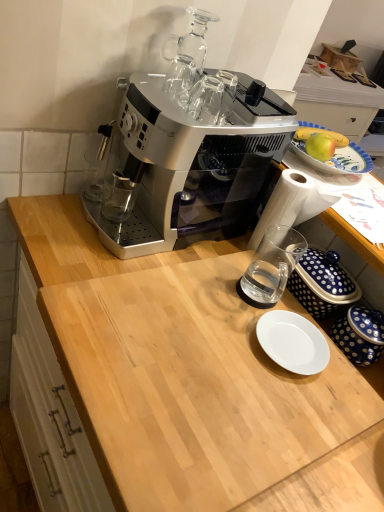
What do you see at coordinates (360, 335) in the screenshot? I see `blue dotted ceramic jar at lower right` at bounding box center [360, 335].

Find the location of `satin silver coffee maker at upper center`. satin silver coffee maker at upper center is located at coordinates (188, 163).

Is satin silver coffee maker at upper center beside white glossy plate at center?

No, satin silver coffee maker at upper center is not in contact with white glossy plate at center.

From the picture: How different are the orientations of satin silver coffee maker at upper center and white glossy plate at center in degrees?

0.000922 degrees.

From a real-world perspective, is satin silver coffee maker at upper center positioned above or below white glossy plate at center?

Clearly, from a real-world perspective, satin silver coffee maker at upper center is above white glossy plate at center.

Visually, is white glossy plate at center positioned to the left or to the right of clear glass cup at center?

Clearly, white glossy plate at center is on the right of clear glass cup at center in the image.

Is white glossy plate at center oriented away from clear glass cup at center?

white glossy plate at center is not turned away from clear glass cup at center.

From the image's perspective, is white glossy plate at center above clear glass cup at center?

Incorrect, from the image's perspective, white glossy plate at center is lower than clear glass cup at center.

Which object is more forward, clear glass cup at center or white glossy plate at center?

white glossy plate at center is closer to the camera.

Could you tell me if clear glass cup at center is turned towards white glossy plate at center?

No, clear glass cup at center is not turned towards white glossy plate at center.

Looking at this image, based on their positions, is clear glass cup at center located to the left or right of white glossy plate at center?

Clearly, clear glass cup at center is on the left of white glossy plate at center in the image.

From a real-world perspective, is light wood cutting board at center on top of white glossy plate at center?

No, from a real-world perspective, light wood cutting board at center is not on top of white glossy plate at center.

Considering the positions of point (133, 506) and point (261, 345), is point (133, 506) closer or farther from the camera than point (261, 345)?

Point (133, 506) is positioned closer to the camera compared to point (261, 345).

Which is correct: light wood cutting board at center is inside white glossy plate at center, or outside of it?

light wood cutting board at center is located beyond the bounds of white glossy plate at center.

From the image's perspective, would you say light wood cutting board at center is shown under white glossy plate at center?

Indeed, from the image's perspective, light wood cutting board at center is shown beneath white glossy plate at center.

Find the location of a particular element. This screenshot has height=512, width=384. counter top lying below the blue dotted ceramic jar at lower right (from the image's perspective) is located at coordinates (193, 388).

Does blue dotted ceramic jar at lower right have a lesser height compared to light wood cutting board at center?

Incorrect, the height of blue dotted ceramic jar at lower right does not fall short of that of light wood cutting board at center.

Is blue dotted ceramic jar at lower right bigger or smaller than light wood cutting board at center?

In the image, blue dotted ceramic jar at lower right appears to be smaller than light wood cutting board at center.

Is there a large distance between blue dotted ceramic jar at lower right and light wood cutting board at center?

→ blue dotted ceramic jar at lower right is actually quite close to light wood cutting board at center.

Based on their positions, is satin silver coffee maker at upper center located to the left or right of green matte apple at upper right?

satin silver coffee maker at upper center is positioned on green matte apple at upper right's left side.

Considering their positions, is satin silver coffee maker at upper center located in front of or behind green matte apple at upper right?

satin silver coffee maker at upper center is positioned closer to the viewer than green matte apple at upper right.

Is satin silver coffee maker at upper center facing away from green matte apple at upper right?

Yes, satin silver coffee maker at upper center is facing away from green matte apple at upper right.

Are satin silver coffee maker at upper center and green matte apple at upper right making contact?

satin silver coffee maker at upper center and green matte apple at upper right are not in contact.

In terms of width, does clear glass cup at center look wider or thinner when compared to satin silver coffee maker at upper center?

Considering their sizes, clear glass cup at center looks slimmer than satin silver coffee maker at upper center.

Locate an element on the screen. This screenshot has height=512, width=384. coffee cup below the satin silver coffee maker at upper center (from a real-world perspective) is located at coordinates (271, 266).

Between point (298, 253) and point (135, 152), which one is positioned in front?

The point (135, 152) is closer to the camera.

Is clear glass cup at center inside the boundaries of satin silver coffee maker at upper center, or outside?

clear glass cup at center exists outside the volume of satin silver coffee maker at upper center.

You are a GUI agent. You are given a task and a screenshot of the screen. Output one action in this format:
    pyautogui.click(x=<x>, y=<y>)
    Task: Click on the plate that is under the satin silver coffee maker at upper center (from a real-world perspective)
    Image resolution: width=384 pixels, height=512 pixels.
    Given the screenshot: What is the action you would take?
    pyautogui.click(x=292, y=342)

You are a GUI agent. You are given a task and a screenshot of the screen. Output one action in this format:
    pyautogui.click(x=<x>, y=<y>)
    Task: Click on the plate below the clear glass cup at center (from the image's perspective)
    
    Given the screenshot: What is the action you would take?
    pyautogui.click(x=292, y=342)

Which object lies nearer to the anchor point satin silver coffee maker at upper center, transparent glass cups at upper center or clear glass cup at center?

transparent glass cups at upper center lies closer to satin silver coffee maker at upper center than the other object.

In the scene shown: Considering their positions, is satin silver coffee maker at upper center positioned closer to green matte apple at upper right than transparent glass cups at upper center?

Based on the image, satin silver coffee maker at upper center appears to be nearer to green matte apple at upper right.

Considering their positions, is transparent glass cups at upper center positioned closer to white glossy plate at center than blue dotted ceramic jar at lower right?

blue dotted ceramic jar at lower right is positioned closer to the anchor white glossy plate at center.

Estimate the real-world distances between objects in this image. Which object is further from transparent glass cups at upper center, clear glass cup at center or green matte apple at upper right?

Among the two, clear glass cup at center is located further to transparent glass cups at upper center.

Estimate the real-world distances between objects in this image. Which object is further from blue dotted ceramic jar at lower right, transparent glass cups at upper center or green matte apple at upper right?

transparent glass cups at upper center lies further to blue dotted ceramic jar at lower right than the other object.

Considering their positions, is transparent glass cups at upper center positioned closer to clear glass cup at center than light wood cutting board at center?

light wood cutting board at center is positioned closer to the anchor clear glass cup at center.

Based on the photo, considering their positions, is blue dotted ceramic jar at lower right positioned further to white glossy plate at center than clear glass cup at center?

Based on the image, clear glass cup at center appears to be further to white glossy plate at center.

Estimate the real-world distances between objects in this image. Which object is closer to transparent glass cups at upper center, white glossy plate at center or clear glass cup at center?

clear glass cup at center.

The height and width of the screenshot is (512, 384). Identify the location of tableware positioned between light wood cutting board at center and clear glass cup at center from near to far. (360, 335).

Identify the location of apple between transparent glass cups at upper center and clear glass cup at center in the vertical direction. (320, 146).

Locate an element on the screen. The width and height of the screenshot is (384, 512). tableware between satin silver coffee maker at upper center and light wood cutting board at center in the up-down direction is located at coordinates (360, 335).

Where is `coffee maker that lies between transparent glass cups at upper center and white glossy plate at center from top to bottom`? This screenshot has height=512, width=384. coffee maker that lies between transparent glass cups at upper center and white glossy plate at center from top to bottom is located at coordinates (188, 163).